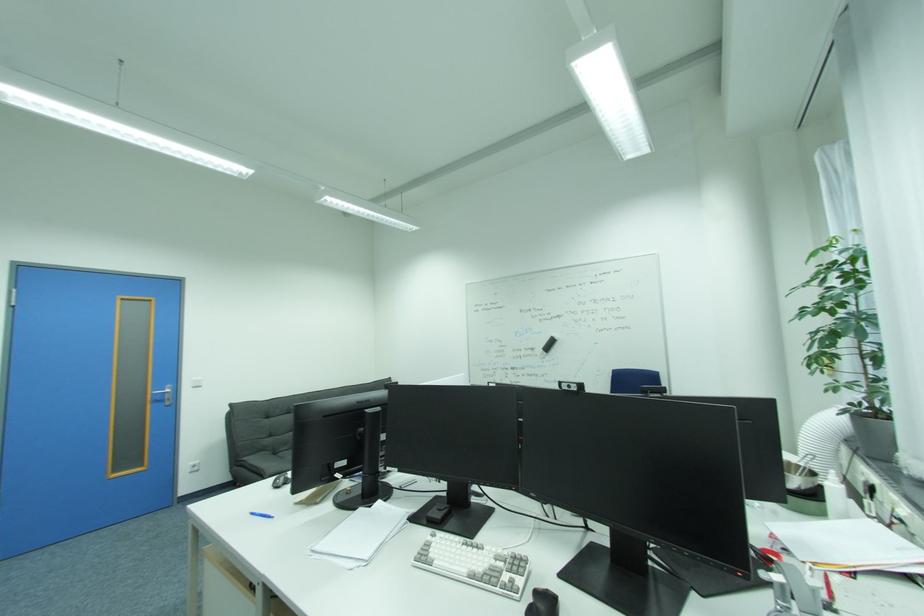
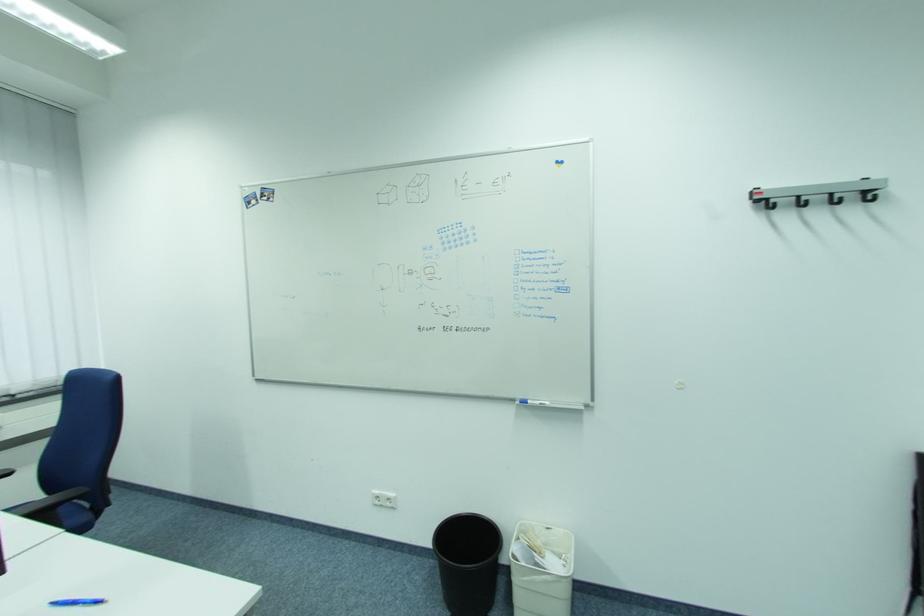
In the second image, find the point that corresponds to point (280, 517) in the first image.

(57, 605)